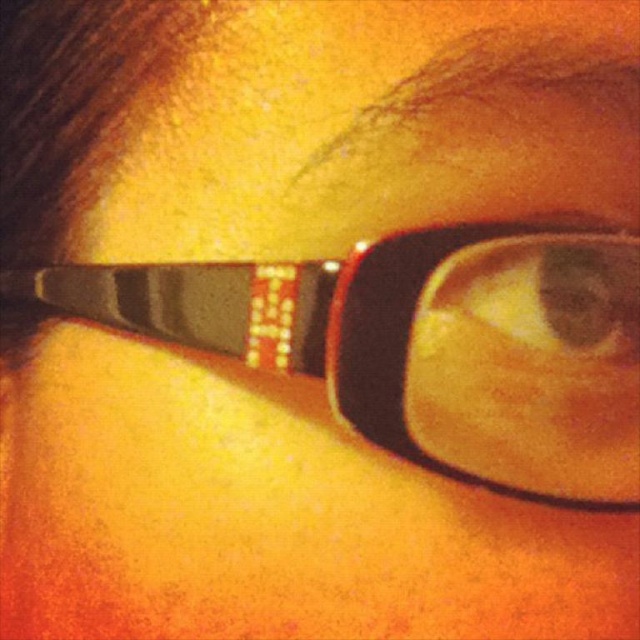
You are a photographer trying to adjust the focus on your camera. You want to ensure that both the matte black glasses at center and the matte plastic eye at center are in focus. Which object should you adjust the focus to first based on their sizes?

The matte black glasses at center is bigger than the matte plastic eye at center, so you should focus on the matte black glasses at center first since larger objects often require more precise focus adjustments to ensure clarity.

You are a photographer adjusting the focus of your camera. You notice two points in the image at coordinates point (566, 490) and point (497, 253). Which point should you focus on to ensure the subject is sharp and in focus?

You should focus on point (566, 490) because it is closer to the viewer than point (497, 253), ensuring the subject remains sharp and in focus.

You are a photographer adjusting the lighting for a portrait. You notice the matte black glasses at center and the matte plastic eye at center in the frame. Which object is more to the left in the photo?

The matte black glasses at center is positioned on the left side of the matte plastic eye at center, so it is more to the left.